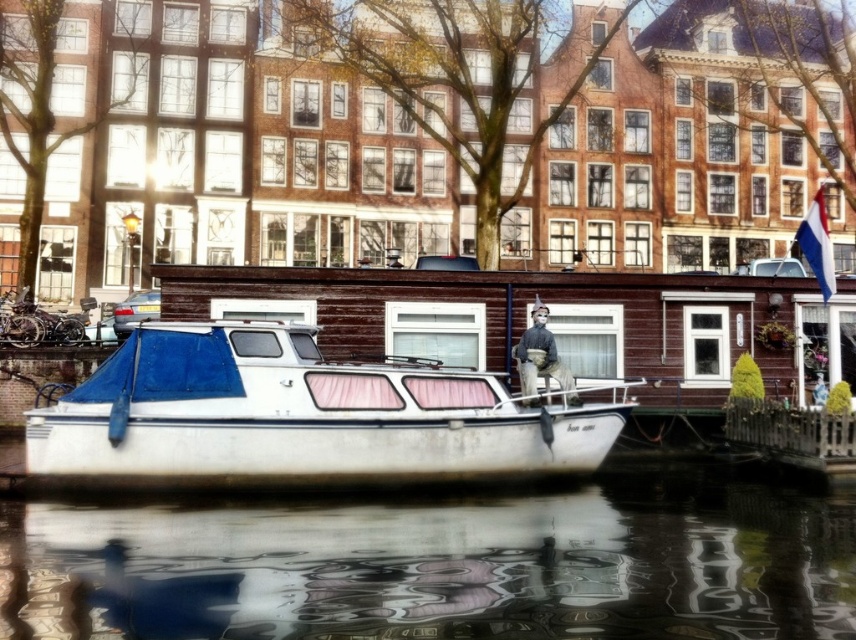
Question: Which point is closer to the camera?

Choices:
 (A) (282, 580)
 (B) (473, 452)

Answer: (A)

Question: Is glossy reflective water at lower center to the left of white matte boat at center from the viewer's perspective?

Choices:
 (A) no
 (B) yes

Answer: (A)

Question: Among these objects, which one is farthest from the camera?

Choices:
 (A) white matte boat at center
 (B) glossy reflective water at lower center

Answer: (A)

Question: Is glossy reflective water at lower center bigger than white matte boat at center?

Choices:
 (A) yes
 (B) no

Answer: (B)

Question: In this image, where is glossy reflective water at lower center located relative to white matte boat at center?

Choices:
 (A) left
 (B) right

Answer: (B)